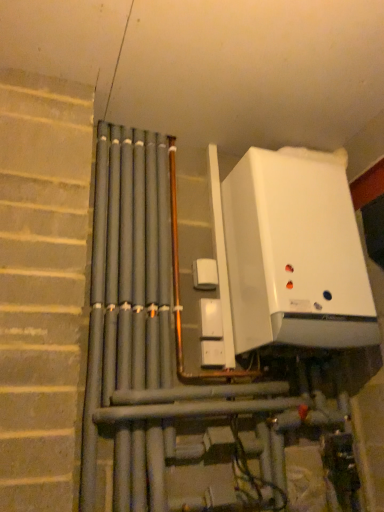
Identify the location of white glossy boiler at upper right. This screenshot has width=384, height=512. (295, 252).

Measure the distance between white glossy boiler at upper right and camera.

white glossy boiler at upper right and camera are 4.72 feet apart from each other.

Describe the element at coordinates (295, 252) in the screenshot. I see `white glossy boiler at upper right` at that location.

Image resolution: width=384 pixels, height=512 pixels. I want to click on white glossy boiler at upper right, so click(295, 252).